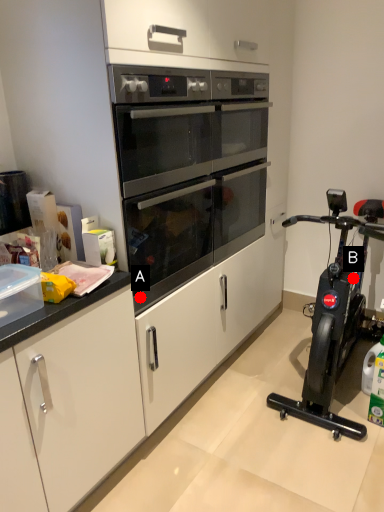
Question: Two points are circled on the image, labeled by A and B beside each circle. Which point is farther from the camera taking this photo?

Choices:
 (A) A is further
 (B) B is further

Answer: (B)